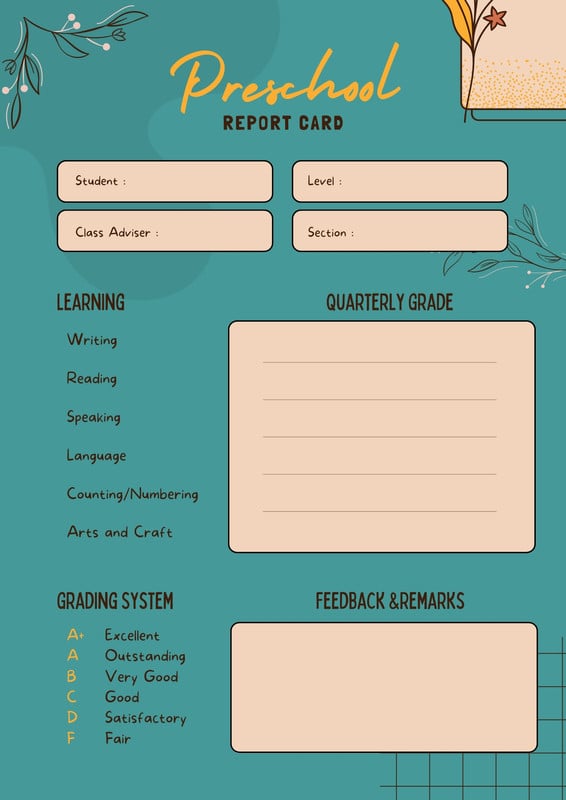
I want to click on box, so click(408, 230).